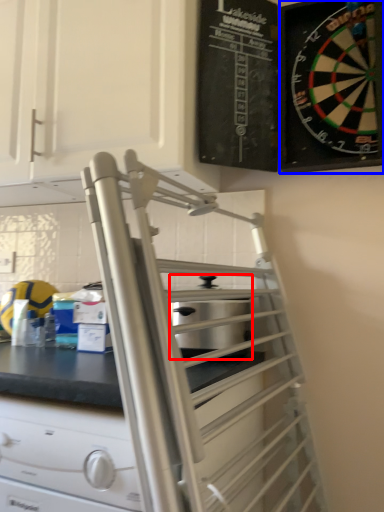
Question: Which object appears farthest to the camera in this image, appliance (highlighted by a red box) or cabinetry (highlighted by a blue box)?

Choices:
 (A) appliance
 (B) cabinetry

Answer: (A)